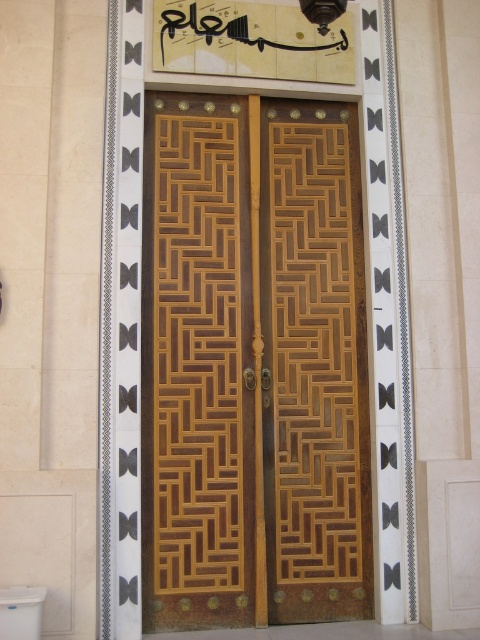
You are a contractor measuring the height of objects in a room. You have a 2m ladder. The wooden door at center and the white glossy toilet bowl at lower left are in your view. Which object requires the ladder to reach its top if the ladder can only extend to 1.8m?

The wooden door at center has a greater height compared to the white glossy toilet bowl at lower left. If the ladder can only extend to 1.8m, then the wooden door at center would require the ladder to reach its top if its height exceeds 1.8m, but the exact height isn

You are a painter who wants to paint both the wooden door at center and the white glossy toilet bowl at lower left. Which object requires more paint because it is wider?

The wooden door at center requires more paint because its width surpasses the white glossy toilet bowl at lower left.

You are standing in a bathroom and see the wooden door at center and the white glossy toilet bowl at lower left. Which object is positioned to the right of the other?

The wooden door at center is to the right of the white glossy toilet bowl at lower left.